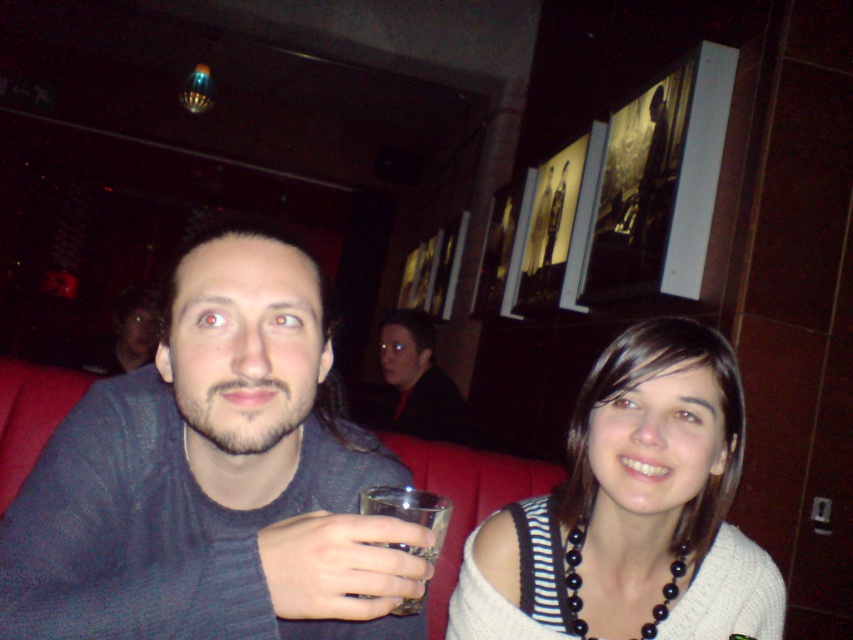
Which is behind, point (183, 339) or point (521, 576)?

The point (521, 576) is more distant.

Image resolution: width=853 pixels, height=640 pixels. In order to click on gray knit sweater at center in this screenshot , I will do `click(213, 477)`.

Is white knitted sweater at center bigger than transparent glass at lower center?

Correct, white knitted sweater at center is larger in size than transparent glass at lower center.

Identify the location of white knitted sweater at center. Image resolution: width=853 pixels, height=640 pixels. [631, 509].

You are a GUI agent. You are given a task and a screenshot of the screen. Output one action in this format:
    pyautogui.click(x=<x>, y=<y>)
    Task: Click on the white knitted sweater at center
    This screenshot has width=853, height=640.
    Given the screenshot: What is the action you would take?
    pyautogui.click(x=631, y=509)

In order to click on dark red fabric jacket at center in this screenshot , I will do `click(418, 380)`.

Between point (432, 336) and point (434, 513), which one is positioned in front?

Positioned in front is point (434, 513).

Who is more distant from viewer, (401, 385) or (431, 499)?

The point (401, 385) is behind.

Locate an element on the screen. The height and width of the screenshot is (640, 853). dark red fabric jacket at center is located at coordinates (418, 380).